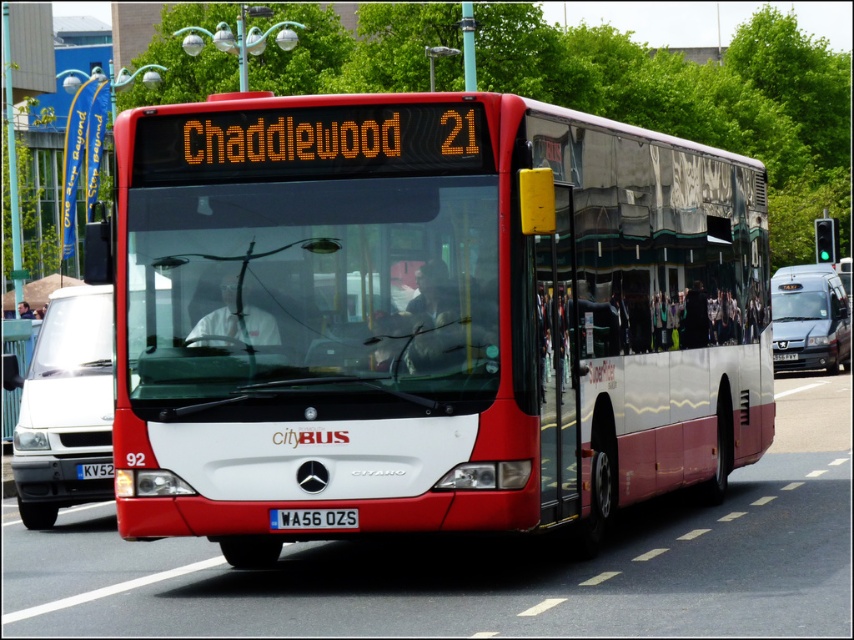
You are standing on the sidewalk next to the road where the red and white Mercedes Benz Citaro bus is driving. There are two points marked on the road ahead of you. The first point is at coordinates point (x=61, y=396) and the second point is at coordinates point (x=112, y=474). Which point is closer to you?

Point (x=61, y=396) is closer to you because it is further to the viewer than point (x=112, y=474).

You are a traffic officer observing a road scene. You notice a white matte van at left and a blue metallic license plate at center. Which object is larger in size?

The white matte van at left is bigger than the blue metallic license plate at center.